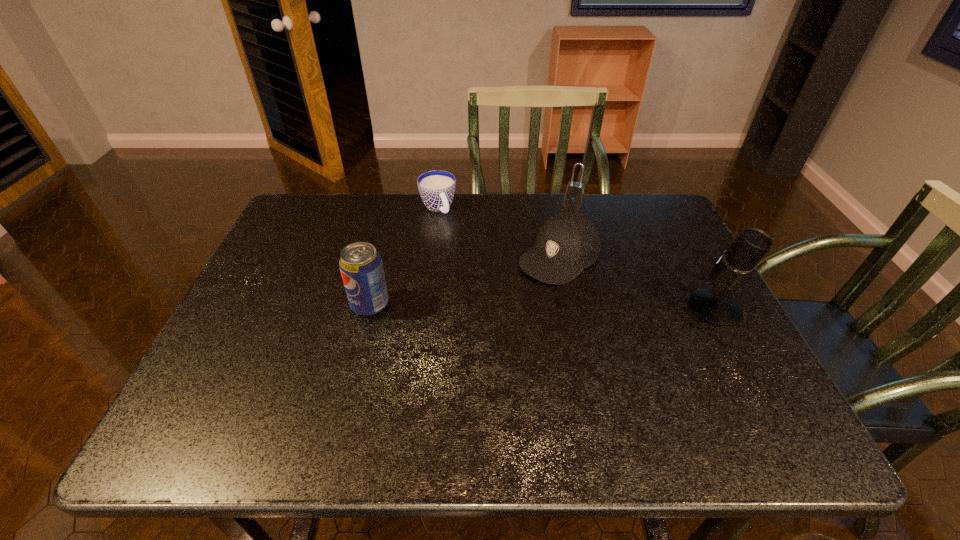
You are a GUI agent. You are given a task and a screenshot of the screen. Output one action in this format:
    pyautogui.click(x=<x>, y=<y>)
    Task: Click on the free location that satisfies the following two spatial constraints: 1. on the back side of the padlock; 2. on the left side of the leftmost object
    This screenshot has width=960, height=540.
    Given the screenshot: What is the action you would take?
    pyautogui.click(x=396, y=199)

You are a GUI agent. You are given a task and a screenshot of the screen. Output one action in this format:
    pyautogui.click(x=<x>, y=<y>)
    Task: Click on the blank area in the image that satisfies the following two spatial constraints: 1. on the back side of the soda; 2. on the left side of the fourth object from right to left
    This screenshot has height=540, width=960.
    Given the screenshot: What is the action you would take?
    pyautogui.click(x=395, y=208)

I want to click on vacant position in the image that satisfies the following two spatial constraints: 1. on the front side of the rightmost object; 2. on the left side of the padlock, so click(605, 308).

Where is `vacant region that satisfies the following two spatial constraints: 1. on the front side of the cup; 2. on the left side of the tallest object`? vacant region that satisfies the following two spatial constraints: 1. on the front side of the cup; 2. on the left side of the tallest object is located at coordinates (425, 308).